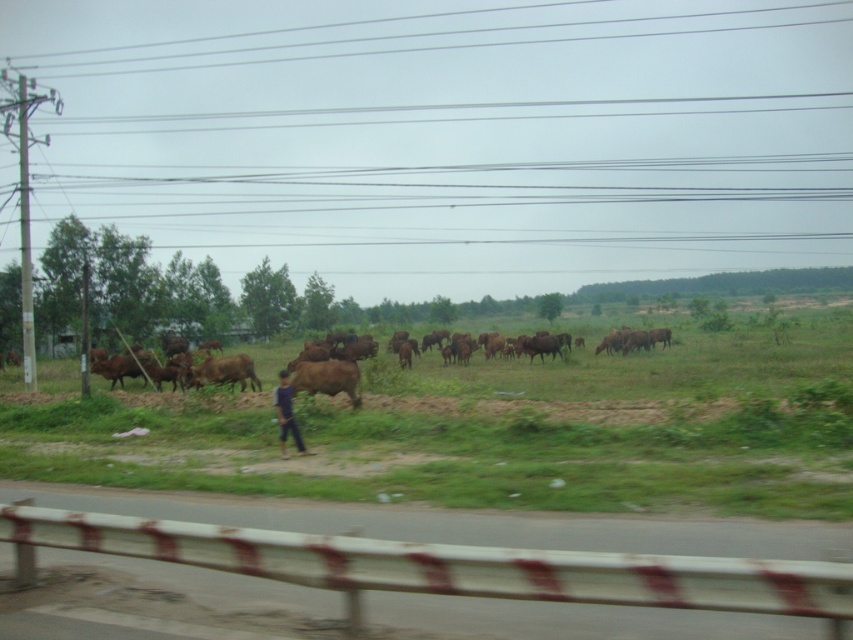
Looking at this image, you are standing at the point labeled point (76, 500) and want to walk to point (274, 392). Which direction should you move relative to the guardrail?

Since point (76, 500) is closer to the viewer than point (274, 392), you should move away from the guardrail to reach point (274, 392).

You are a farmer checking the field. You notice the brown matte bull at center and the blue fabric shirt at center. Which object is taller?

The blue fabric shirt at center is taller than the brown matte bull at center.